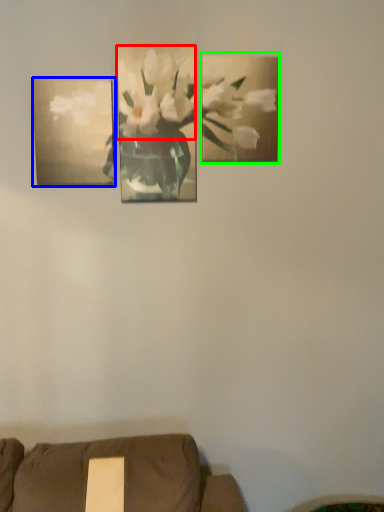
Question: Based on their relative distances, which object is nearer to flower (highlighted by a red box)? Choose from picture frame (highlighted by a blue box) and picture frame (highlighted by a green box).

Choices:
 (A) picture frame
 (B) picture frame

Answer: (B)